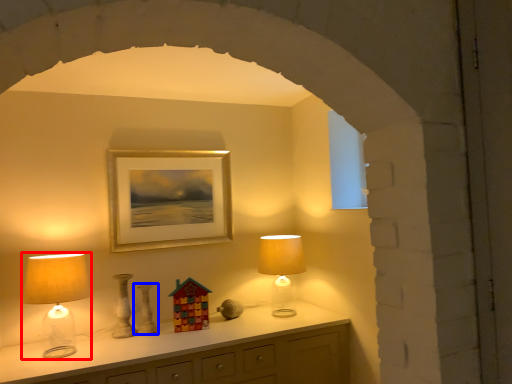
Question: Which object is further to the camera taking this photo, lamp (highlighted by a red box) or vase (highlighted by a blue box)?

Choices:
 (A) lamp
 (B) vase

Answer: (B)